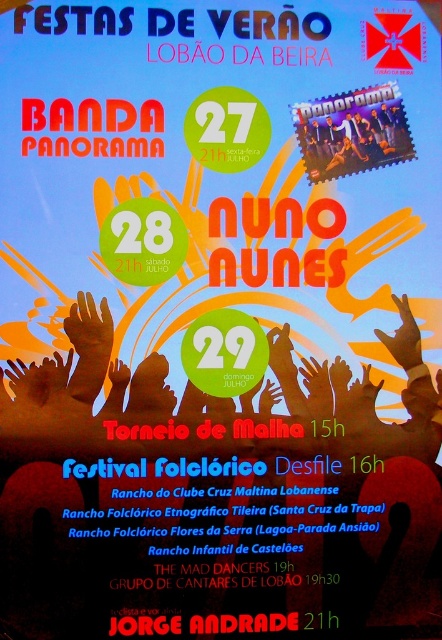
Question: Which object is closer to the camera taking this photo?

Choices:
 (A) matte black band at upper right
 (B) brown matte hands at center

Answer: (B)

Question: Is brown matte hands at center bigger than matte black band at upper right?

Choices:
 (A) yes
 (B) no

Answer: (A)

Question: Which of the following is the farthest from the observer?

Choices:
 (A) matte black band at upper right
 (B) brown matte hands at center

Answer: (A)

Question: From the image, what is the correct spatial relationship of brown matte hands at center in relation to matte black band at upper right?

Choices:
 (A) left
 (B) right

Answer: (A)

Question: Among these points, which one is farthest from the camera?

Choices:
 (A) (389, 157)
 (B) (76, 412)

Answer: (A)

Question: Does brown matte hands at center appear on the left side of matte black band at upper right?

Choices:
 (A) yes
 (B) no

Answer: (A)